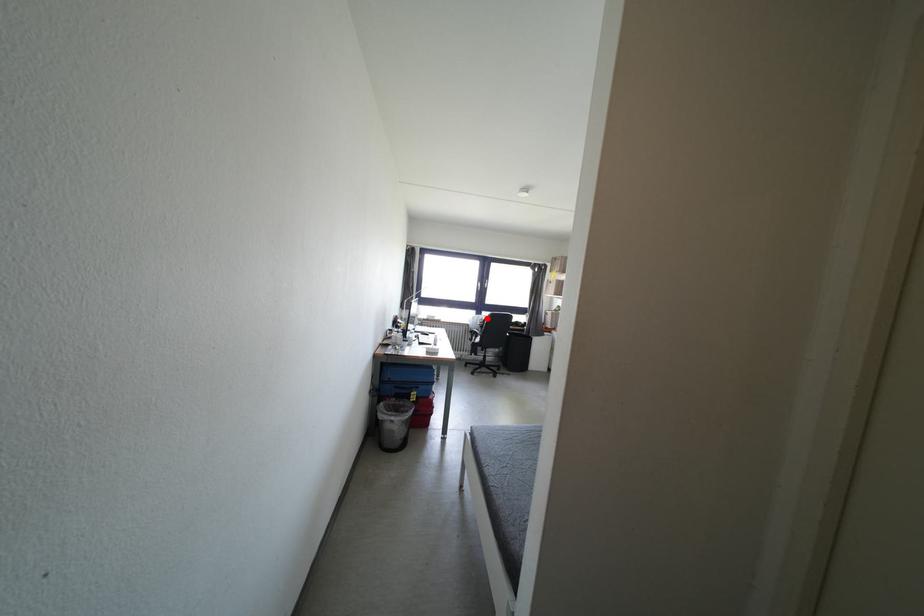
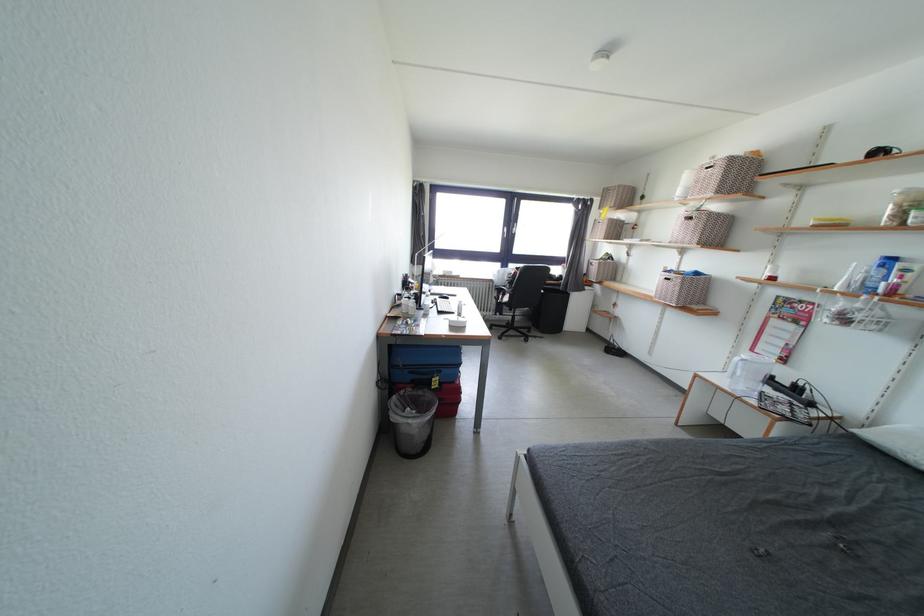
In the second image, find the point that corresponds to the highlighted location in the first image.

(514, 270)